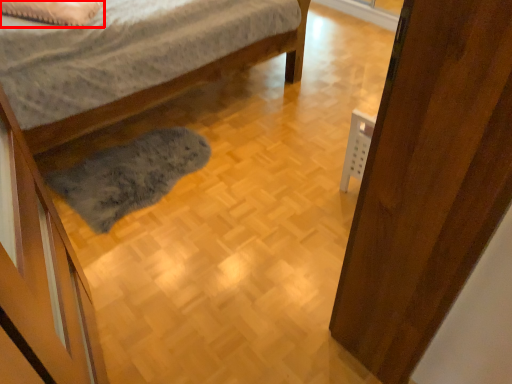
Question: From the image's perspective, where is pillow (annotated by the red box) located relative to door?

Choices:
 (A) below
 (B) above

Answer: (B)